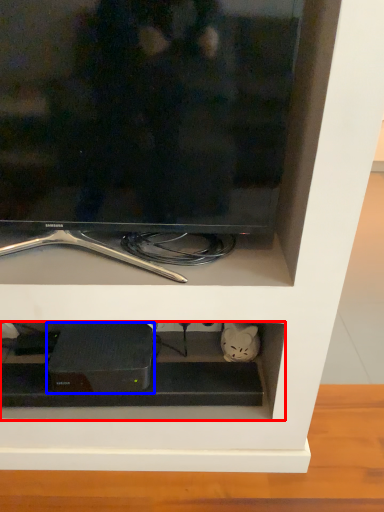
Question: Which point is closer to the camera, cabinet (highlighted by a red box) or appliance (highlighted by a blue box)?

Choices:
 (A) cabinet
 (B) appliance

Answer: (B)